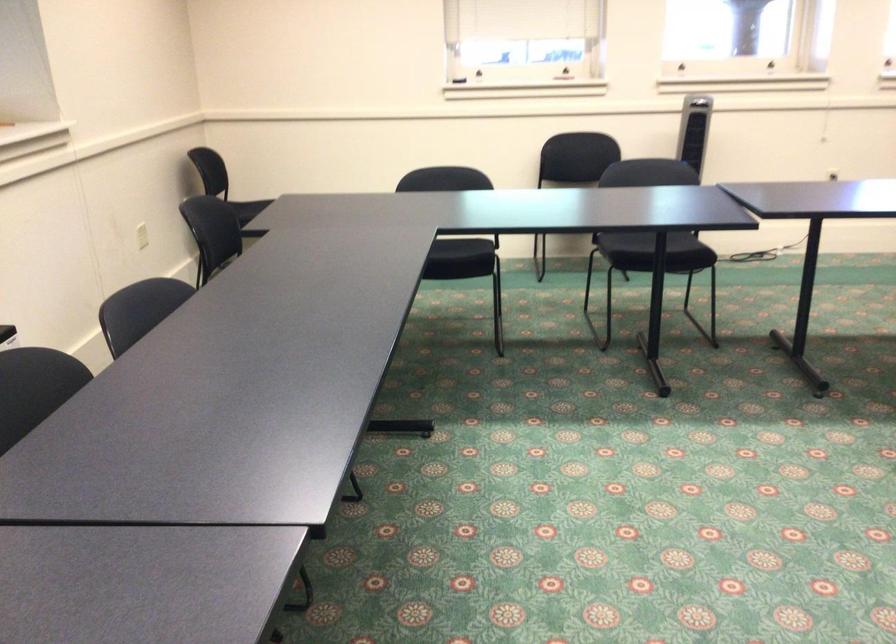
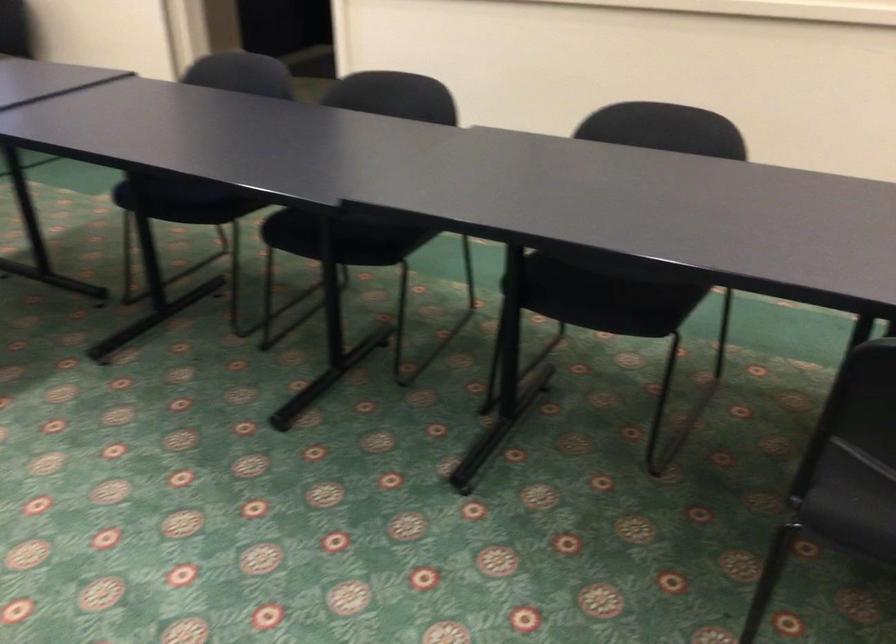
The first image is from the beginning of the video and the second image is from the end. How did the camera likely rotate when shooting the video?

The camera's rotation is toward right-down.